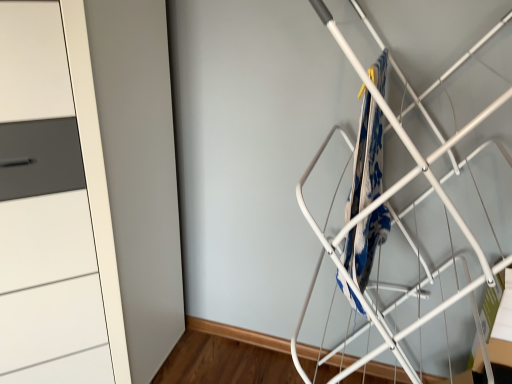
Question: Do you think white matte cabinet at left is within blue printed fabric at center-right, or outside of it?

Choices:
 (A) outside
 (B) inside

Answer: (A)

Question: From a real-world perspective, relative to blue printed fabric at center-right, is white matte cabinet at left vertically above or below?

Choices:
 (A) above
 (B) below

Answer: (B)

Question: Relative to blue printed fabric at center-right, is white matte cabinet at left in front or behind?

Choices:
 (A) behind
 (B) front

Answer: (B)

Question: Looking at the image, does blue printed fabric at center-right seem bigger or smaller compared to white matte cabinet at left?

Choices:
 (A) big
 (B) small

Answer: (B)

Question: Considering the positions of point (369, 94) and point (0, 372), is point (369, 94) closer or farther from the camera than point (0, 372)?

Choices:
 (A) farther
 (B) closer

Answer: (B)

Question: Visually, is blue printed fabric at center-right positioned to the left or to the right of white matte cabinet at left?

Choices:
 (A) left
 (B) right

Answer: (B)

Question: Considering the positions of blue printed fabric at center-right and white matte cabinet at left in the image, is blue printed fabric at center-right taller or shorter than white matte cabinet at left?

Choices:
 (A) short
 (B) tall

Answer: (A)